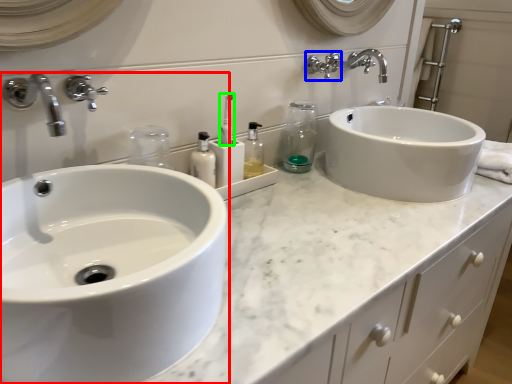
Question: Estimate the real-world distances between objects in this image. Which object is farther from sink (highlighted by a red box), plumbing fixture (highlighted by a blue box) or toothbrush (highlighted by a green box)?

Choices:
 (A) plumbing fixture
 (B) toothbrush

Answer: (A)